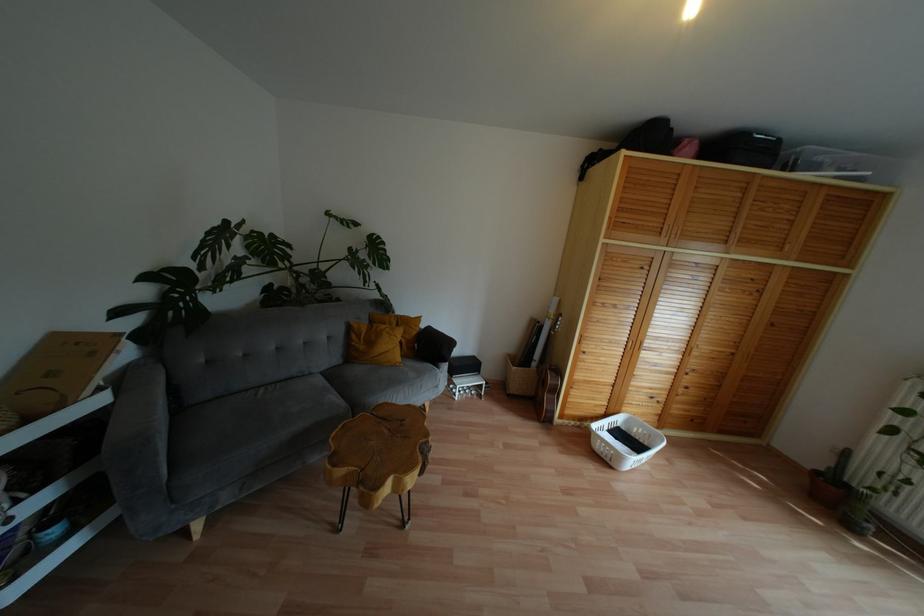
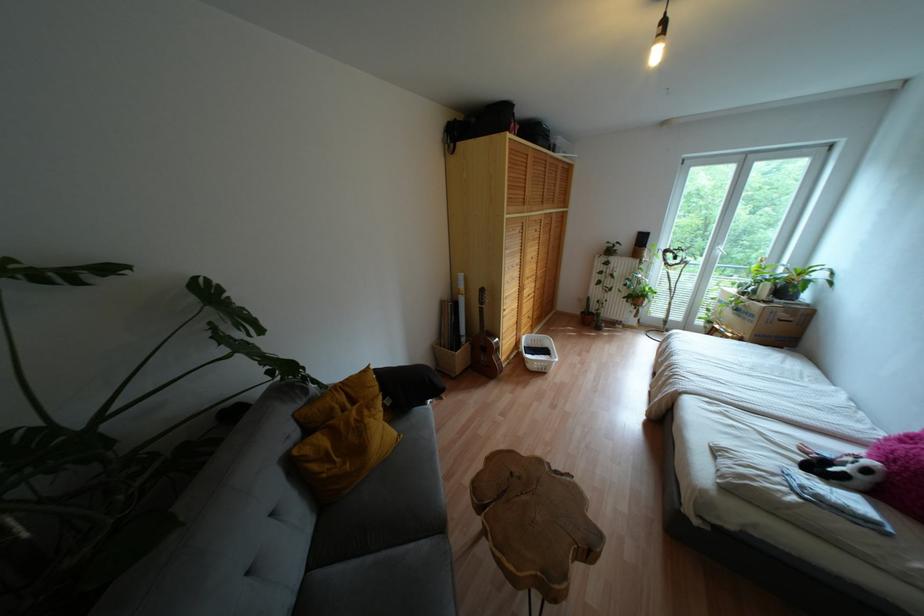
In the second image, find the point that corresponds to (333,389) in the first image.

(383, 553)